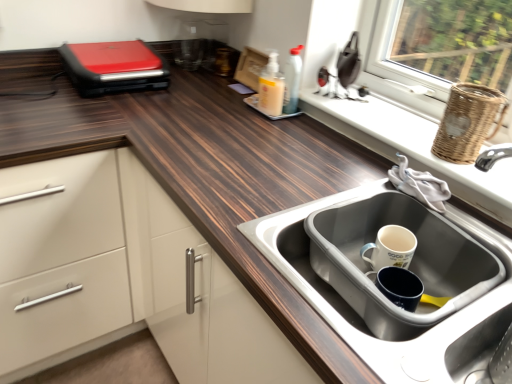
Question: Which direction should I rotate to look at translucent plastic soap dispenser at center?

Choices:
 (A) left
 (B) right

Answer: (B)

Question: Is woven brown basket at upper right smaller than translucent plastic soap dispenser at center?

Choices:
 (A) no
 (B) yes

Answer: (A)

Question: Considering the relative sizes of woven brown basket at upper right and translucent plastic soap dispenser at center in the image provided, is woven brown basket at upper right thinner than translucent plastic soap dispenser at center?

Choices:
 (A) no
 (B) yes

Answer: (A)

Question: Can you confirm if woven brown basket at upper right is taller than translucent plastic soap dispenser at center?

Choices:
 (A) no
 (B) yes

Answer: (B)

Question: Does woven brown basket at upper right come behind translucent plastic soap dispenser at center?

Choices:
 (A) no
 (B) yes

Answer: (A)

Question: Is woven brown basket at upper right positioned far away from translucent plastic soap dispenser at center?

Choices:
 (A) no
 (B) yes

Answer: (A)

Question: Does woven brown basket at upper right have a lesser height compared to translucent plastic soap dispenser at center?

Choices:
 (A) yes
 (B) no

Answer: (B)

Question: Is translucent plastic soap dispenser at center beside white wicker basket at right?

Choices:
 (A) no
 (B) yes

Answer: (A)

Question: Is translucent plastic soap dispenser at center further to the viewer compared to white wicker basket at right?

Choices:
 (A) yes
 (B) no

Answer: (A)

Question: Considering the relative sizes of translucent plastic soap dispenser at center and white wicker basket at right in the image provided, is translucent plastic soap dispenser at center taller than white wicker basket at right?

Choices:
 (A) yes
 (B) no

Answer: (A)

Question: From the image's perspective, would you say translucent plastic soap dispenser at center is shown under white wicker basket at right?

Choices:
 (A) yes
 (B) no

Answer: (B)

Question: Is translucent plastic soap dispenser at center positioned with its back to white wicker basket at right?

Choices:
 (A) no
 (B) yes

Answer: (A)

Question: Would you say translucent plastic soap dispenser at center contains white wicker basket at right?

Choices:
 (A) no
 (B) yes

Answer: (A)

Question: Can you confirm if translucent plastic soap dispenser at center is thinner than stainless steel sink at lower right?

Choices:
 (A) no
 (B) yes

Answer: (B)